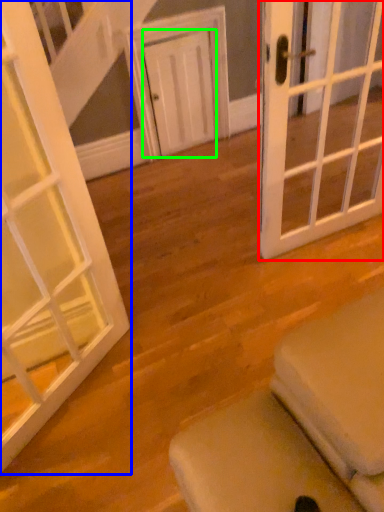
Question: Which object is positioned closest to door (highlighted by a red box)? Select from door (highlighted by a blue box) and door (highlighted by a green box).

Choices:
 (A) door
 (B) door

Answer: (A)